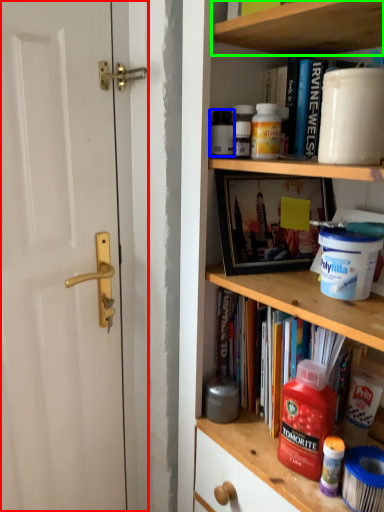
Question: Considering the real-world distances, which object is farthest from door (highlighted by a red box)? bottle (highlighted by a blue box) or cabinet (highlighted by a green box)?

Choices:
 (A) bottle
 (B) cabinet

Answer: (B)